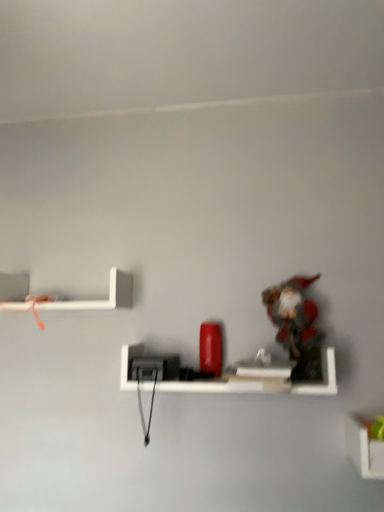
Question: From a real-world perspective, is white matte shelf at lower right, which appears as the 3th shelf when viewed from the top, positioned above or below matte black shelf at center, which appears as the 2th shelf when ordered from the bottom?

Choices:
 (A) above
 (B) below

Answer: (B)

Question: Considering the positions of white matte shelf at lower right, which ranks as the 1th shelf in bottom-to-top order, and matte black shelf at center, which appears as the second shelf when viewed from the top, in the image, is white matte shelf at lower right, which ranks as the 1th shelf in bottom-to-top order, wider or thinner than matte black shelf at center, which appears as the second shelf when viewed from the top,?

Choices:
 (A) thin
 (B) wide

Answer: (A)

Question: Considering the real-world distances, which object is closest to the white matte shelf at lower right, which appears as the 3th shelf when viewed from the top?

Choices:
 (A) white matte shelf at upper left, acting as the 1th shelf starting from the left
 (B) matte black shelf at center, which ranks as the second shelf in left-to-right order
 (C) fuzzy fabric toy at right

Answer: (C)

Question: Which of these objects is positioned farthest from the matte black shelf at center, marked as the second shelf in a right-to-left arrangement?

Choices:
 (A) fuzzy fabric toy at right
 (B) white matte shelf at upper left, the 3th shelf positioned from the bottom
 (C) white matte shelf at lower right, which ranks as the 1th shelf in bottom-to-top order

Answer: (B)